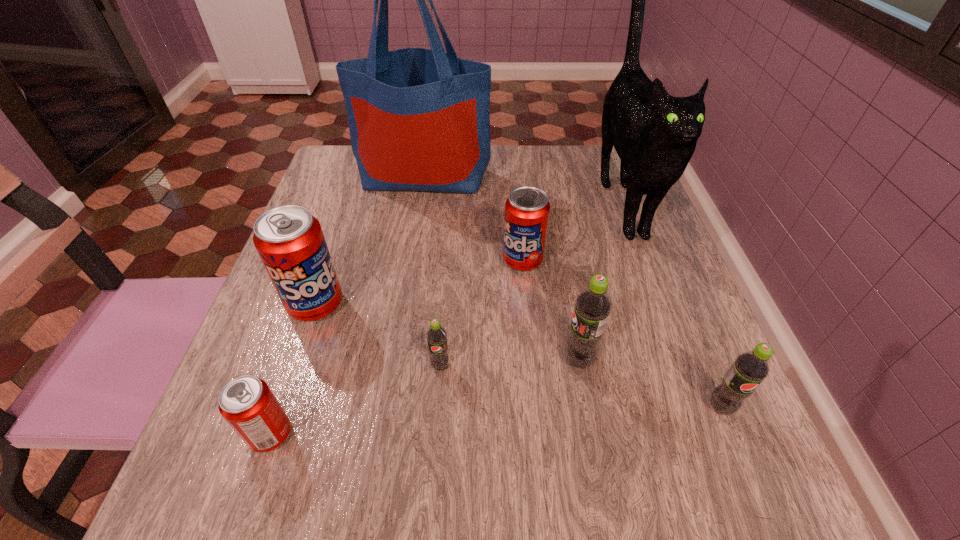
Locate an element on the screen. The height and width of the screenshot is (540, 960). red handbag is located at coordinates (419, 119).

Identify the location of black cat. The height and width of the screenshot is (540, 960). (654, 134).

The image size is (960, 540). Find the location of `the fourth farthest object`. the fourth farthest object is located at coordinates (290, 242).

Locate an element on the screen. This screenshot has width=960, height=540. the biggest red soda can is located at coordinates (290, 242).

Locate an element on the screen. This screenshot has height=540, width=960. the second soda can from right to left is located at coordinates (593, 305).

At what (x,y) coordinates should I click in order to perform the action: click on the third object from right to left. Please return your answer as a coordinate pair (x, y). This screenshot has width=960, height=540. Looking at the image, I should click on (593, 305).

Find the location of a particular element. This screenshot has height=540, width=960. the fourth object from right to left is located at coordinates (527, 209).

Find the location of a particular element. The image size is (960, 540). the fourth soda can from left to right is located at coordinates (527, 209).

Find the location of a particular element. The image size is (960, 540). the second smallest green soda is located at coordinates (750, 368).

I want to click on the nearest green soda, so click(750, 368).